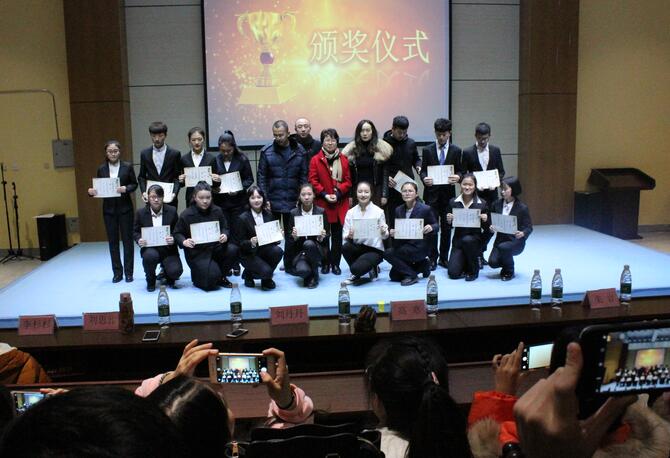
Locate an element on the screen. stage is located at coordinates click(590, 250).